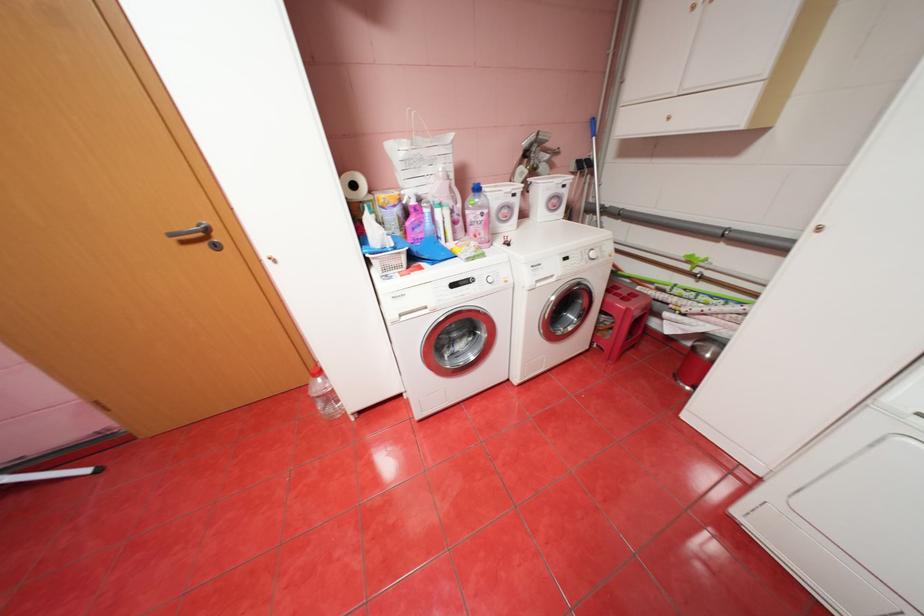
The image size is (924, 616). Identify the location of washing machine door handle. (588, 301).